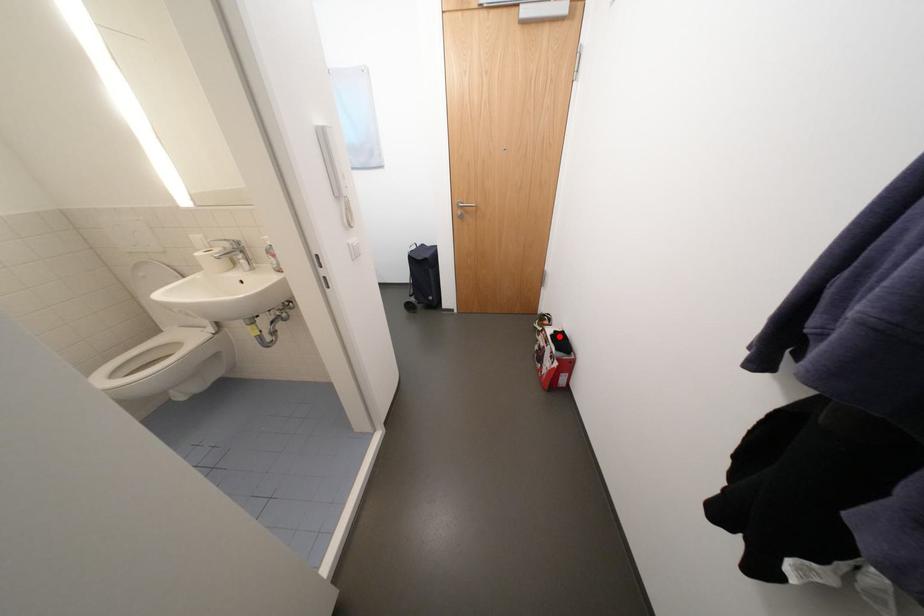
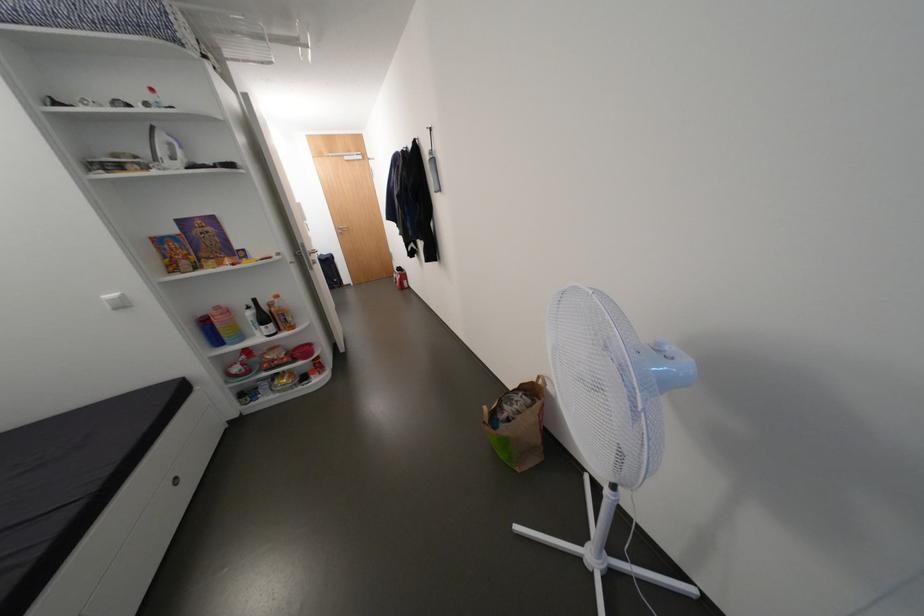
In the second image, find the point that corresponds to the highlighted location in the first image.

(405, 270)